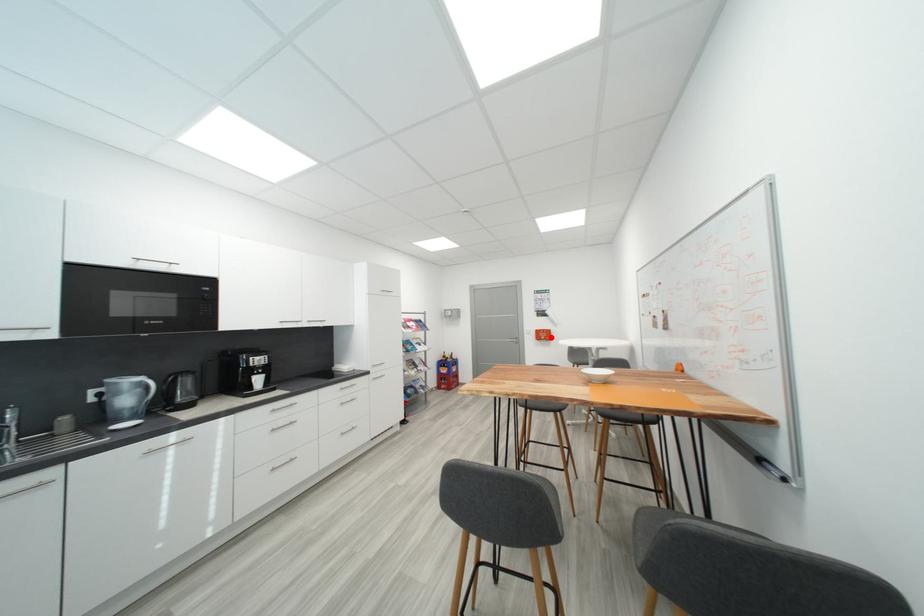
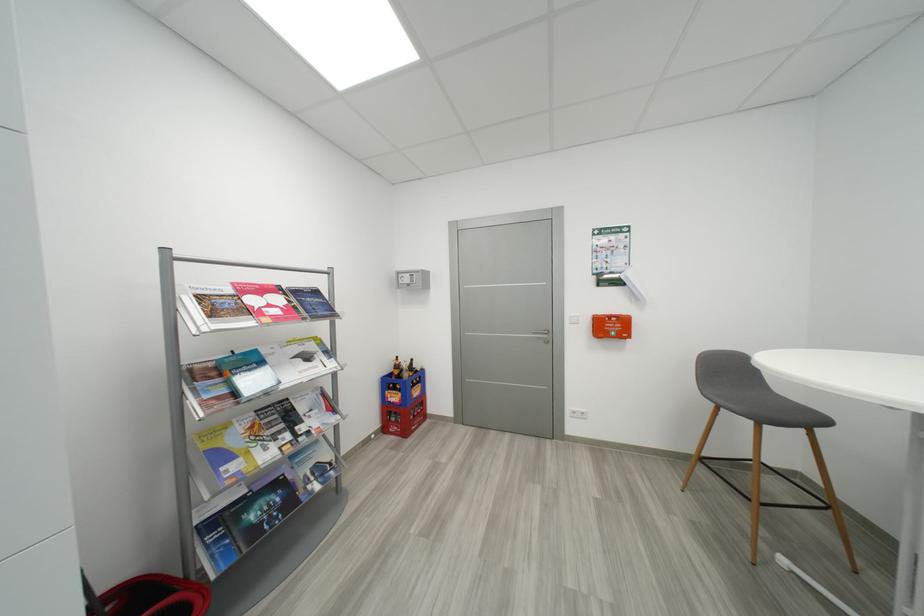
The point at the highlighted location is marked in the first image. Where is the corresponding point in the second image?

(617, 330)